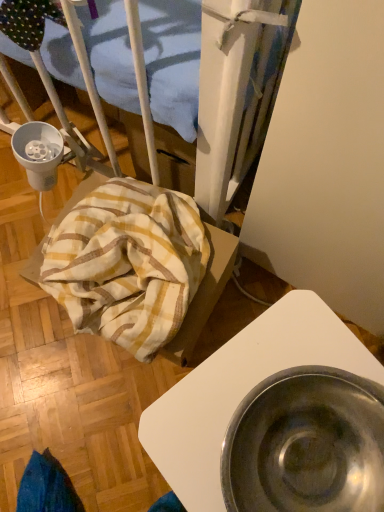
This screenshot has width=384, height=512. I want to click on vacant region to the left of metallic silver bowl at lower right, so click(x=112, y=425).